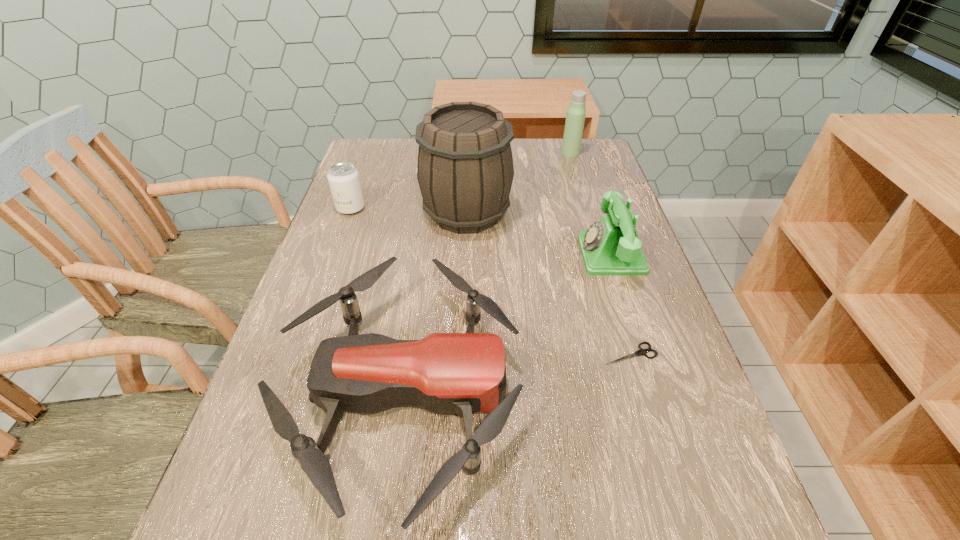
Identify the location of vacant region that satisfies the following two spatial constraints: 1. on the back side of the wine bucket; 2. on the right side of the farthest object. This screenshot has height=540, width=960. (468, 153).

I want to click on vacant space that satisfies the following two spatial constraints: 1. on the back side of the second tallest object; 2. on the left side of the soda can, so click(x=371, y=153).